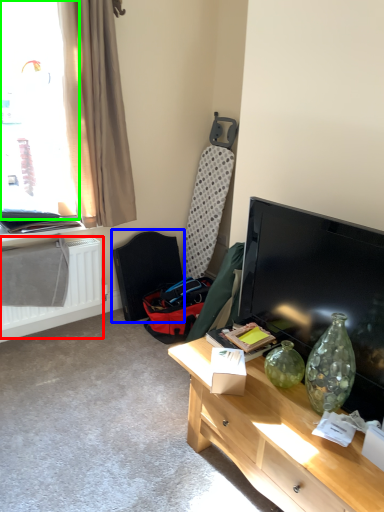
Question: Which object is positioned farthest from radiator (highlighted by a red box)? Select from swivel chair (highlighted by a blue box) and window (highlighted by a green box).

Choices:
 (A) swivel chair
 (B) window

Answer: (B)